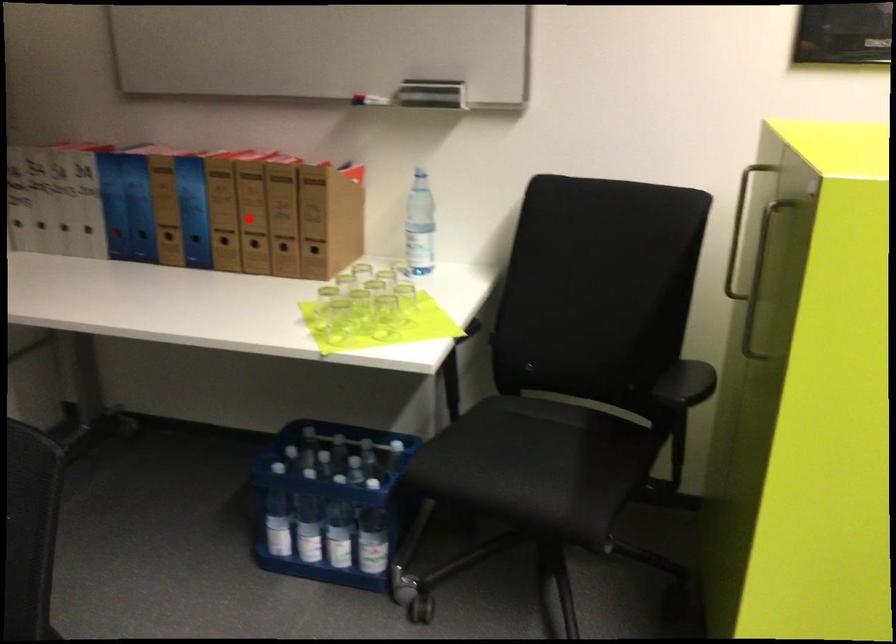
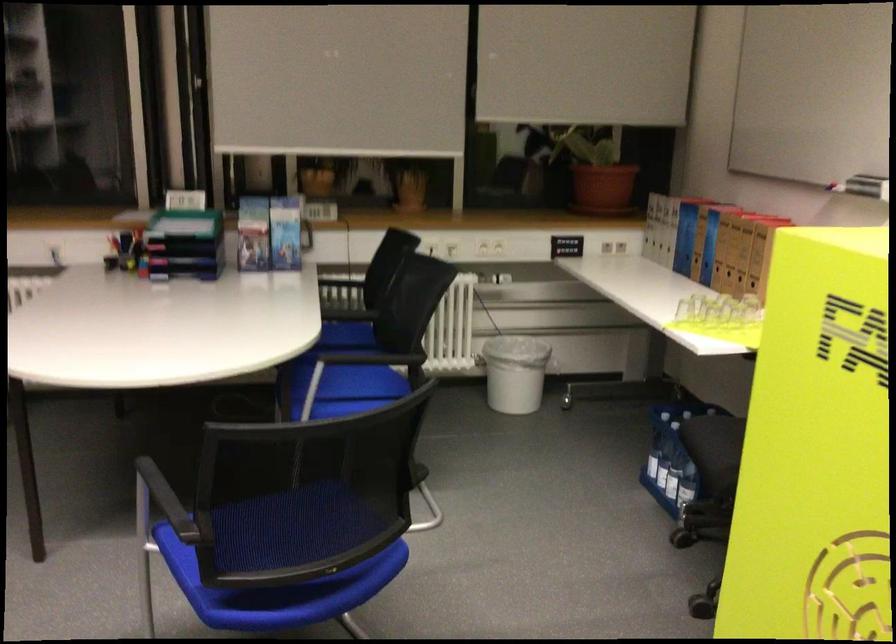
Question: I am providing you with two images of the same scene from different viewpoints. Given a red point in image1, look at the same physical point in image2. Is it:

Choices:
 (A) Closer to the viewpoint
 (B) Farther from the viewpoint

Answer: (B)